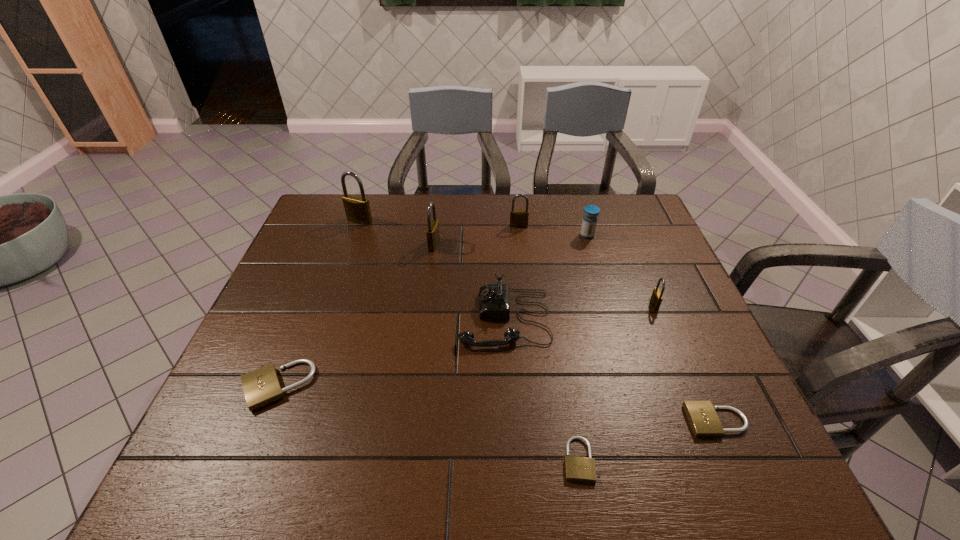
At what (x,y) coordinates should I click in order to perform the action: click on the biggest brass padlock. Please return your answer as a coordinate pair (x, y). Looking at the image, I should click on (357, 209).

Find the location of `the leftmost brass padlock`. the leftmost brass padlock is located at coordinates (357, 209).

Identify the location of the eighth shortest object. The image size is (960, 540). (432, 232).

Locate an element on the screen. The width and height of the screenshot is (960, 540). the second biggest brass padlock is located at coordinates (432, 232).

Where is `the third tallest padlock`? the third tallest padlock is located at coordinates (518, 218).

At what (x,y) coordinates should I click in order to perform the action: click on the seventh shortest object. Please return your answer as a coordinate pair (x, y). The image size is (960, 540). Looking at the image, I should click on (518, 218).

Where is `blue medicine`? This screenshot has height=540, width=960. blue medicine is located at coordinates (589, 222).

You are a GUI agent. You are given a task and a screenshot of the screen. Output one action in this format:
    pyautogui.click(x=<x>, y=<y>)
    Task: Click on the medicine
    The image size is (960, 540).
    Given the screenshot: What is the action you would take?
    pyautogui.click(x=589, y=222)

The image size is (960, 540). I want to click on the rightmost brass padlock, so click(x=656, y=298).

Locate an element on the screen. This screenshot has width=960, height=540. the smallest brass padlock is located at coordinates (656, 298).